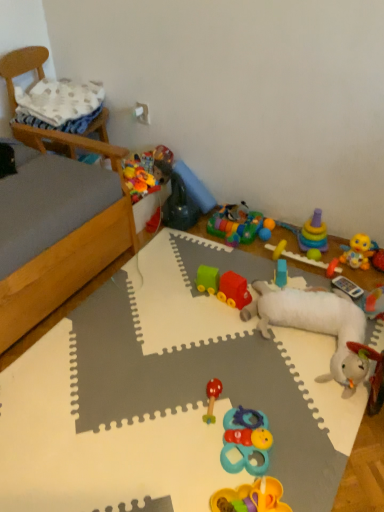
The image size is (384, 512). I want to click on free space in front of rubberized plastic train at center, which is counted as the 4th toy, starting from the bottom, so click(228, 325).